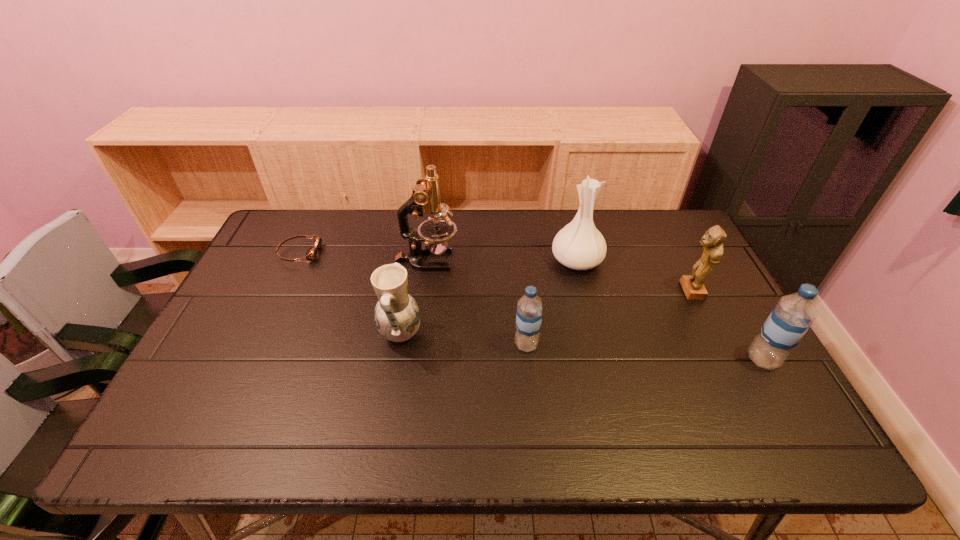
Where is `vase at the far edge`? Image resolution: width=960 pixels, height=540 pixels. vase at the far edge is located at coordinates (579, 245).

Locate an element on the screen. This screenshot has width=960, height=540. microscope located at the far edge is located at coordinates (425, 199).

At what (x,y) coordinates should I click in order to perform the action: click on object that is at the left edge. Please return your answer as a coordinate pair (x, y). Looking at the image, I should click on (311, 254).

Identify the location of water bottle present at the right edge. (790, 319).

Where is `figurine that is at the right edge`? Image resolution: width=960 pixels, height=540 pixels. figurine that is at the right edge is located at coordinates (712, 241).

What are the coordinates of `object that is at the far left corner` in the screenshot? It's located at (311, 254).

This screenshot has width=960, height=540. I want to click on vacant space at the far edge, so click(605, 225).

At what (x,y) coordinates should I click in order to perform the action: click on vacant space at the near edge of the desktop. Please return your answer as a coordinate pair (x, y). This screenshot has height=540, width=960. Looking at the image, I should click on (342, 400).

You are a GUI agent. You are given a task and a screenshot of the screen. Output one action in this format:
    pyautogui.click(x=<x>, y=<y>)
    Task: Click on the vacant space at the left edge of the desktop
    
    Given the screenshot: What is the action you would take?
    pyautogui.click(x=273, y=305)

Where is `vacant space at the right edge of the desktop`? vacant space at the right edge of the desktop is located at coordinates (666, 264).